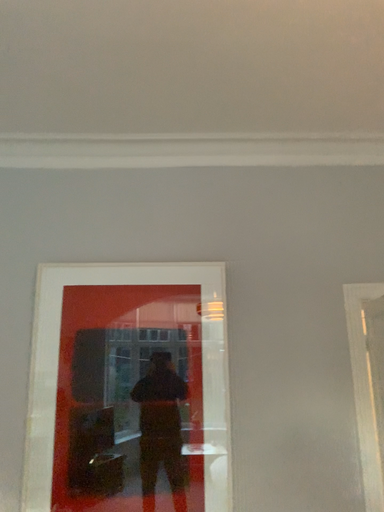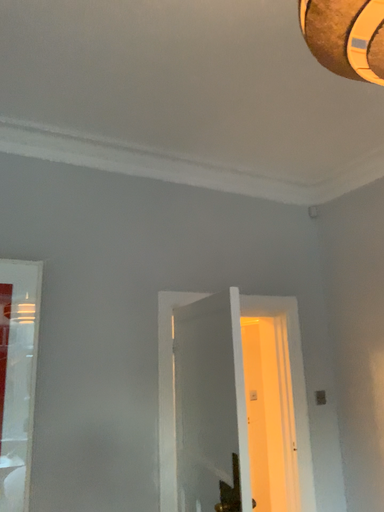
Question: Which way did the camera rotate in the video?

Choices:
 (A) rotated right
 (B) rotated left

Answer: (A)